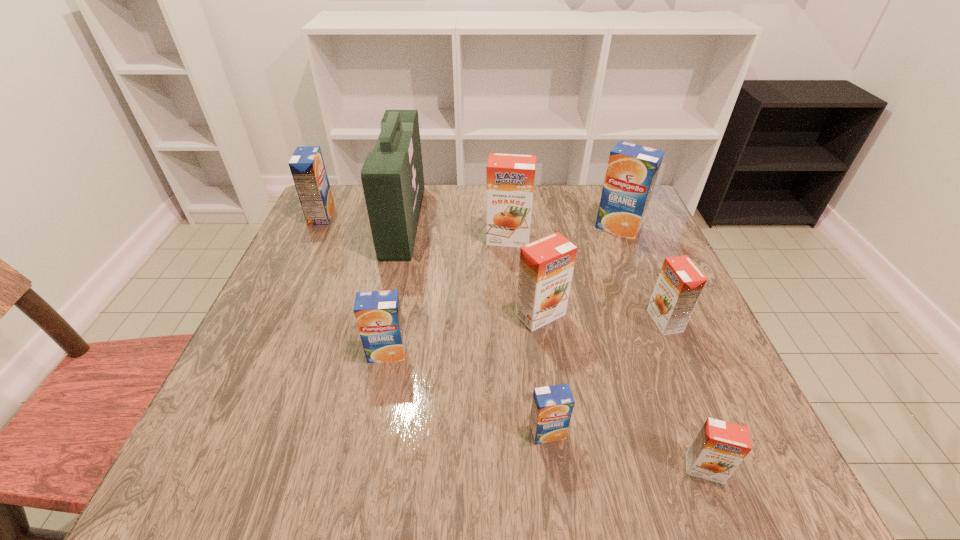
Where is `vacant space that satisfies the following two spatial constraints: 1. on the front-facing side of the first-aid kit; 2. on the left side of the biggest orange orange juice`? vacant space that satisfies the following two spatial constraints: 1. on the front-facing side of the first-aid kit; 2. on the left side of the biggest orange orange juice is located at coordinates (399, 239).